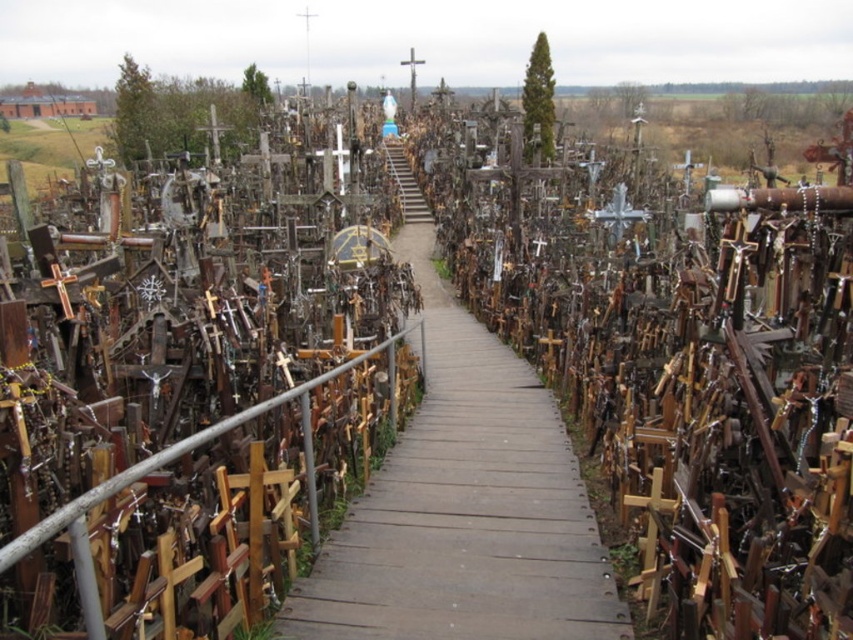
Which of these two, wooden walkway at center or metallic cross at left, stands shorter?

metallic cross at left is shorter.

The width and height of the screenshot is (853, 640). What do you see at coordinates (463, 508) in the screenshot?
I see `wooden walkway at center` at bounding box center [463, 508].

Image resolution: width=853 pixels, height=640 pixels. I want to click on wooden walkway at center, so click(463, 508).

Image resolution: width=853 pixels, height=640 pixels. I want to click on wooden walkway at center, so click(x=463, y=508).